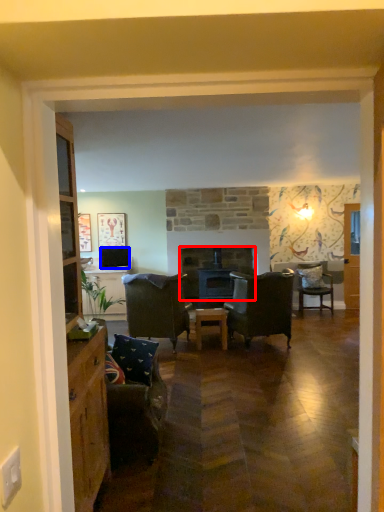
Question: Which object appears closest to the camera in this image, fireplace (highlighted by a red box) or television (highlighted by a blue box)?

Choices:
 (A) fireplace
 (B) television

Answer: (B)